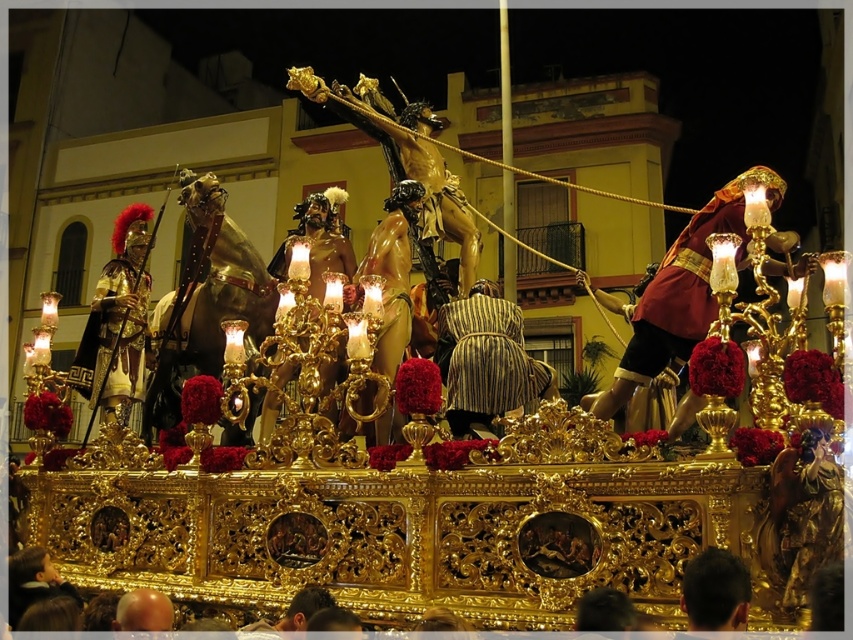
Question: Is shiny gold horse at center thinner than smooth gold orb at center?

Choices:
 (A) yes
 (B) no

Answer: (B)

Question: Which point is closer to the camera?

Choices:
 (A) (720, 573)
 (B) (347, 275)
 (C) (196, 289)

Answer: (A)

Question: Among these points, which one is nearest to the camera?

Choices:
 (A) (198, 349)
 (B) (164, 609)

Answer: (B)

Question: Can you confirm if matte gold statue at right is positioned to the left of gold plated armor at left?

Choices:
 (A) yes
 (B) no

Answer: (B)

Question: Which object is closer to the camera taking this photo?

Choices:
 (A) black hair at lower center
 (B) shiny gold horse at center
 (C) smooth gold orb at center
 (D) gold polished statue at center

Answer: (A)

Question: Considering the relative positions of shiny gold horse at center and smooth gold orb at center in the image provided, where is shiny gold horse at center located with respect to smooth gold orb at center?

Choices:
 (A) above
 (B) below

Answer: (A)